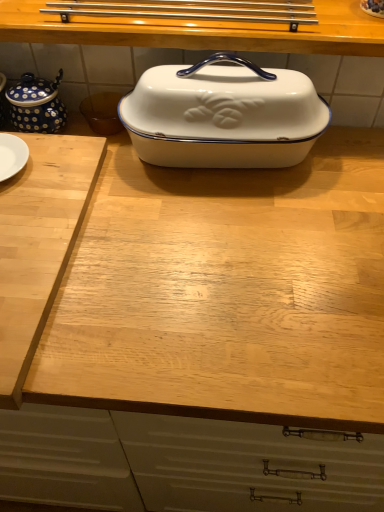
This screenshot has width=384, height=512. I want to click on spots to the right of light wood cutting board at left, so click(x=204, y=266).